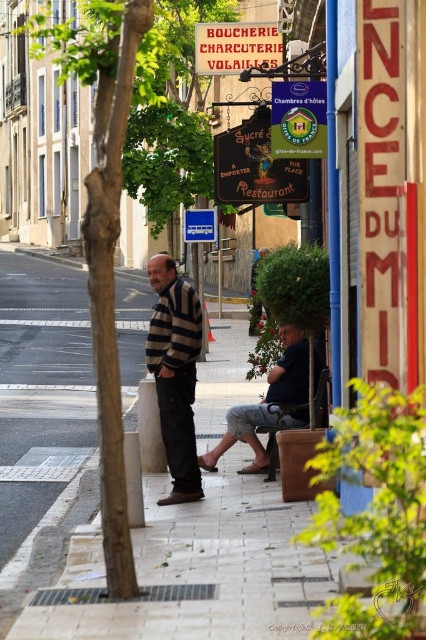
Does dark blue jeans at lower center have a lesser height compared to blue plastic sign at center?

No, dark blue jeans at lower center is not shorter than blue plastic sign at center.

The height and width of the screenshot is (640, 426). What do you see at coordinates (268, 403) in the screenshot?
I see `dark blue jeans at lower center` at bounding box center [268, 403].

Identify the location of dark blue jeans at lower center. pos(268,403).

Does point (169, 422) come farther from viewer compared to point (215, 227)?

No, (169, 422) is closer to viewer.

Is striped sweater at center to the left of blue plastic sign at center from the viewer's perspective?

In fact, striped sweater at center is to the right of blue plastic sign at center.

Which is in front, point (173, 454) or point (192, 236)?

Point (173, 454) is in front.

The width and height of the screenshot is (426, 640). I want to click on striped sweater at center, so point(175,372).

Does striped sweater at center appear on the left side of brown leather stool at lower center?

Indeed, striped sweater at center is positioned on the left side of brown leather stool at lower center.

Which of these two, striped sweater at center or brown leather stool at lower center, stands shorter?

brown leather stool at lower center is shorter.

Who is more distant from viewer, (160, 387) or (273, 454)?

Positioned behind is point (273, 454).

You are a GUI agent. You are given a task and a screenshot of the screen. Output one action in this format:
    pyautogui.click(x=<x>, y=<y>)
    Task: Click on the striped sweater at center
    This screenshot has height=640, width=426.
    Given the screenshot: What is the action you would take?
    pyautogui.click(x=175, y=372)